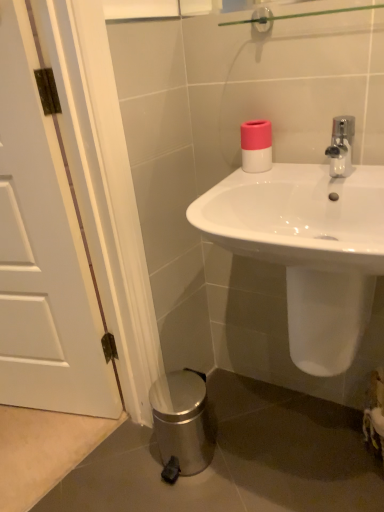
Question: From the image's perspective, is white glossy sink at center under pink matte toilet paper at upper right?

Choices:
 (A) yes
 (B) no

Answer: (A)

Question: Does white glossy sink at center appear on the left side of pink matte toilet paper at upper right?

Choices:
 (A) no
 (B) yes

Answer: (A)

Question: Can you confirm if white glossy sink at center is thinner than pink matte toilet paper at upper right?

Choices:
 (A) no
 (B) yes

Answer: (A)

Question: Considering the relative sizes of white glossy sink at center and pink matte toilet paper at upper right in the image provided, is white glossy sink at center shorter than pink matte toilet paper at upper right?

Choices:
 (A) yes
 (B) no

Answer: (B)

Question: Is white glossy sink at center looking in the opposite direction of pink matte toilet paper at upper right?

Choices:
 (A) yes
 (B) no

Answer: (B)

Question: From a real-world perspective, is white glossy sink at center physically located above or below white matte door at left?

Choices:
 (A) above
 (B) below

Answer: (B)

Question: Is white glossy sink at center spatially inside white matte door at left, or outside of it?

Choices:
 (A) inside
 (B) outside

Answer: (B)

Question: Does point (304, 257) appear closer or farther from the camera than point (44, 316)?

Choices:
 (A) farther
 (B) closer

Answer: (B)

Question: Looking at their shapes, would you say white glossy sink at center is wider or thinner than white matte door at left?

Choices:
 (A) thin
 (B) wide

Answer: (B)

Question: Is white matte door at left situated inside pink matte toilet paper at upper right or outside?

Choices:
 (A) inside
 (B) outside

Answer: (B)

Question: Considering the positions of white matte door at left and pink matte toilet paper at upper right in the image, is white matte door at left taller or shorter than pink matte toilet paper at upper right?

Choices:
 (A) short
 (B) tall

Answer: (B)

Question: In the image, is white matte door at left positioned in front of or behind pink matte toilet paper at upper right?

Choices:
 (A) behind
 (B) front

Answer: (B)

Question: From the image's perspective, relative to pink matte toilet paper at upper right, is white matte door at left above or below?

Choices:
 (A) below
 (B) above

Answer: (A)

Question: In the image, is pink matte toilet paper at upper right on the left side or the right side of white matte door at left?

Choices:
 (A) left
 (B) right

Answer: (B)

Question: Considering their positions, is pink matte toilet paper at upper right located in front of or behind white matte door at left?

Choices:
 (A) behind
 (B) front

Answer: (A)